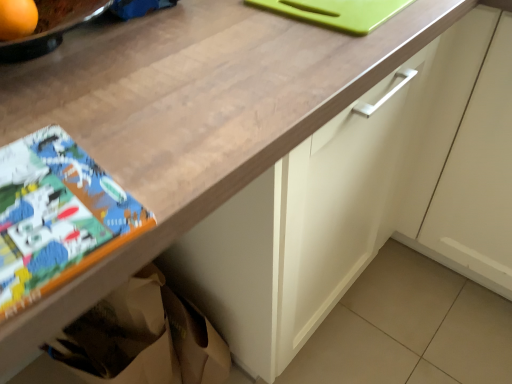
Where is `vacant area that is situated to the right of matte paper comic book at lower left`? The width and height of the screenshot is (512, 384). vacant area that is situated to the right of matte paper comic book at lower left is located at coordinates (186, 170).